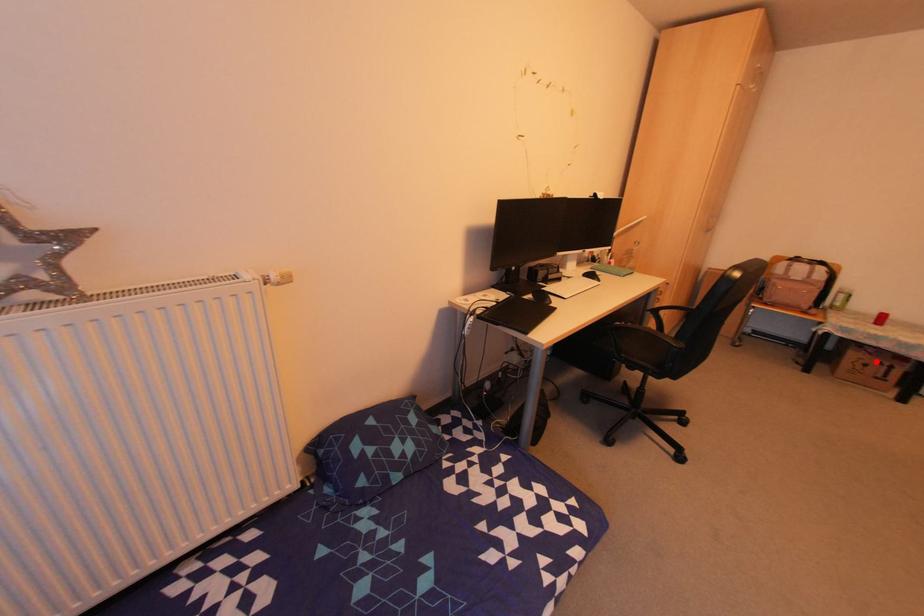
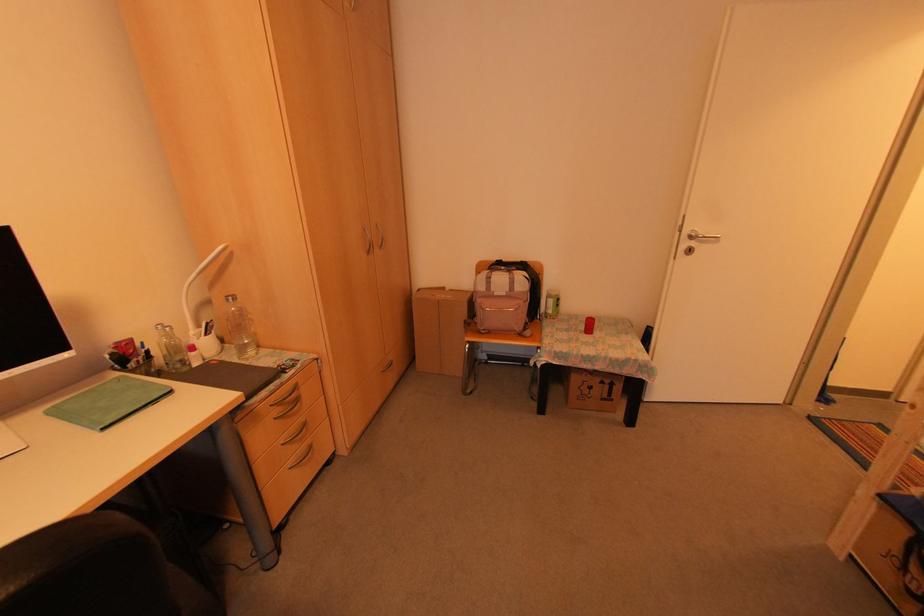
Question: I am providing you with two images of the same scene from different viewpoints. A red point is marked on the first image. Is the red point's position out of view in image 2?

Choices:
 (A) Yes
 (B) No

Answer: (B)